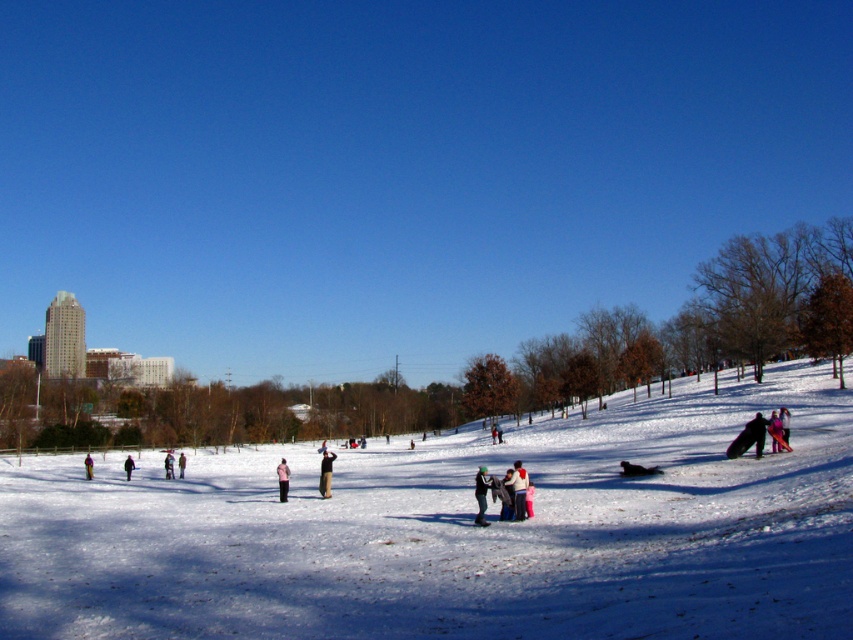
Question: Based on their relative distances, which object is farther from the pink fabric jacket at center?

Choices:
 (A) dark gray pants at lower left
 (B) matte pink snowsuit at lower right
 (C) white cotton jacket at center

Answer: (B)

Question: Where is white cotton jacket at center located in relation to green wool jacket at center in the image?

Choices:
 (A) right
 (B) left

Answer: (A)

Question: Among these points, which one is farthest from the camera?

Choices:
 (A) (173, 460)
 (B) (180, 461)

Answer: (A)

Question: Is white snow at center smaller than light brown snowsuit at center?

Choices:
 (A) no
 (B) yes

Answer: (A)

Question: Can you confirm if dark gray jacket at lower right is positioned below dark gray pants at lower left?

Choices:
 (A) yes
 (B) no

Answer: (B)

Question: Which of the following is the farthest from the observer?

Choices:
 (A) (283, 467)
 (B) (521, 468)
 (C) (782, 424)

Answer: (C)